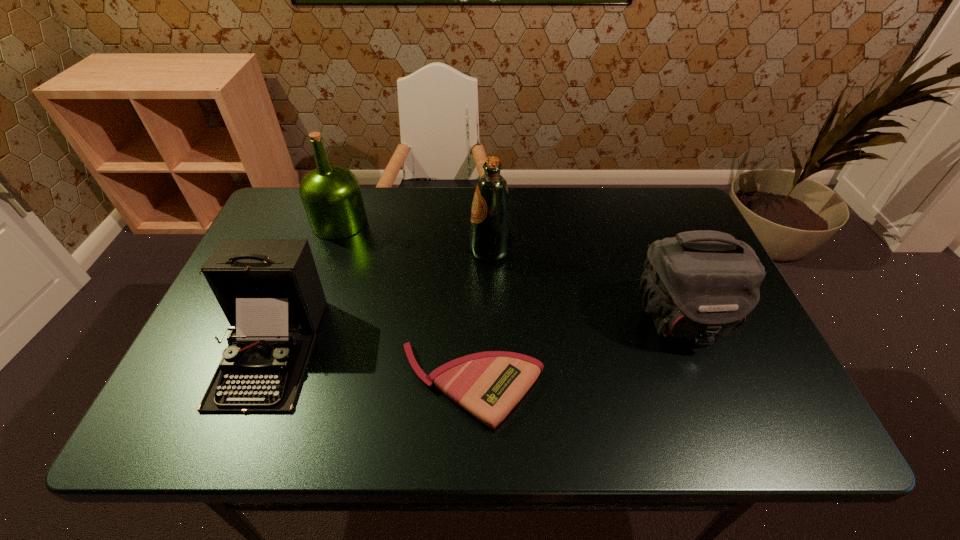
At what (x,y) coordinates should I click in order to perform the action: click on the right olive oil. Please return your answer as a coordinate pair (x, y). Looking at the image, I should click on (490, 239).

Locate an element on the screen. This screenshot has height=540, width=960. the left olive oil is located at coordinates (331, 196).

This screenshot has width=960, height=540. Identify the location of shoulder bag. (700, 285).

Image resolution: width=960 pixels, height=540 pixels. Find the location of `typewriter`. typewriter is located at coordinates (269, 289).

Where is `wristlet`? This screenshot has height=540, width=960. wristlet is located at coordinates (488, 385).

In order to click on free point located 0.050m on the front-facing side of the right olive oil in this screenshot , I will do pos(451,250).

Locate an element on the screen. This screenshot has width=960, height=540. vacant space located on the front-facing side of the right olive oil is located at coordinates (441, 250).

I want to click on free space located 0.120m on the front-facing side of the right olive oil, so click(426, 250).

Locate an element on the screen. This screenshot has height=540, width=960. vacant space situated on the front of the left olive oil is located at coordinates (326, 260).

This screenshot has width=960, height=540. In order to click on vacant space positioned on the open flap of the shoulder bag in this screenshot , I will do `click(704, 376)`.